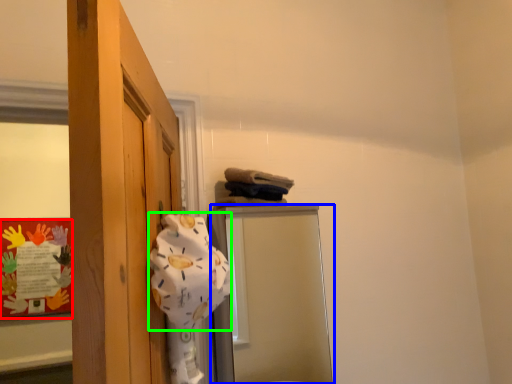
Question: Which object is positioned closest to bulletin board (highlighted by a red box)? Select from mirror (highlighted by a blue box) and bath towel (highlighted by a green box).

Choices:
 (A) mirror
 (B) bath towel

Answer: (A)